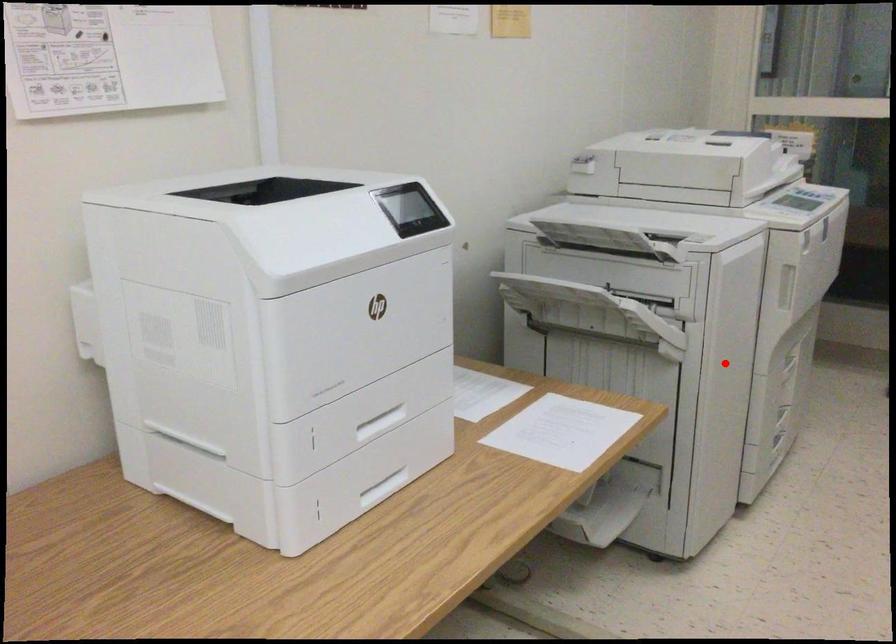
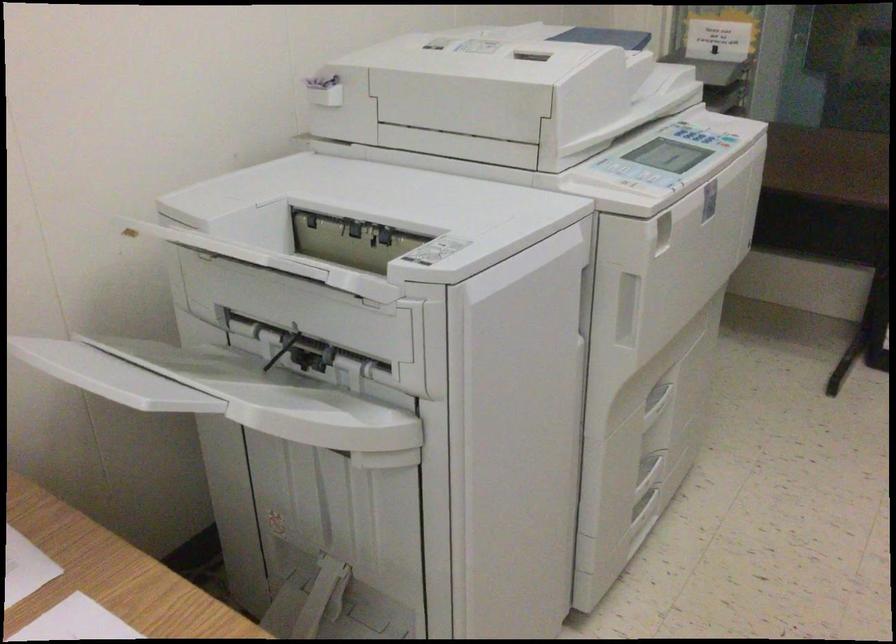
Question: I am providing you with two images of the same scene from different viewpoints. In image1, a red point is highlighted. Considering the same 3D point in image2, which of the following is correct?

Choices:
 (A) It is closer
 (B) It is farther

Answer: (A)